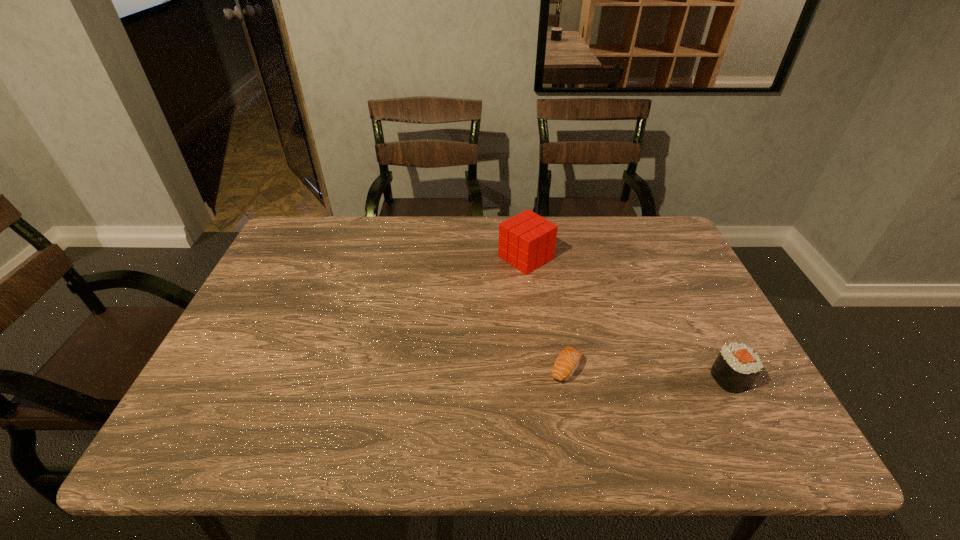
Locate an element on the screen. This screenshot has width=960, height=540. object that is positioned at the right edge is located at coordinates (737, 366).

At what (x,y) coordinates should I click in order to perform the action: click on vacant space at the far edge of the desktop. Please return your answer as a coordinate pair (x, y). This screenshot has width=960, height=540. Looking at the image, I should click on (374, 261).

Image resolution: width=960 pixels, height=540 pixels. What are the coordinates of `vacant space at the near edge` in the screenshot? It's located at (433, 419).

Where is `vacant space at the left edge`? vacant space at the left edge is located at coordinates (247, 368).

The image size is (960, 540). In order to click on blank area at the far left corner in this screenshot , I will do `click(311, 234)`.

Locate an element on the screen. vacant space at the far right corner is located at coordinates [x=681, y=261].

Find the location of a particular element. This screenshot has height=540, width=960. free point between the shorter sushi and the second shortest object is located at coordinates (648, 373).

At what (x,y) coordinates should I click in order to perform the action: click on unoccupied position between the shortest object and the cube. Please return your answer as a coordinate pair (x, y). Looking at the image, I should click on (545, 313).

The height and width of the screenshot is (540, 960). I want to click on free area in between the cube and the left sushi, so click(x=545, y=313).

In order to click on vacant area that lies between the taller sushi and the cube in this screenshot , I will do `click(628, 318)`.